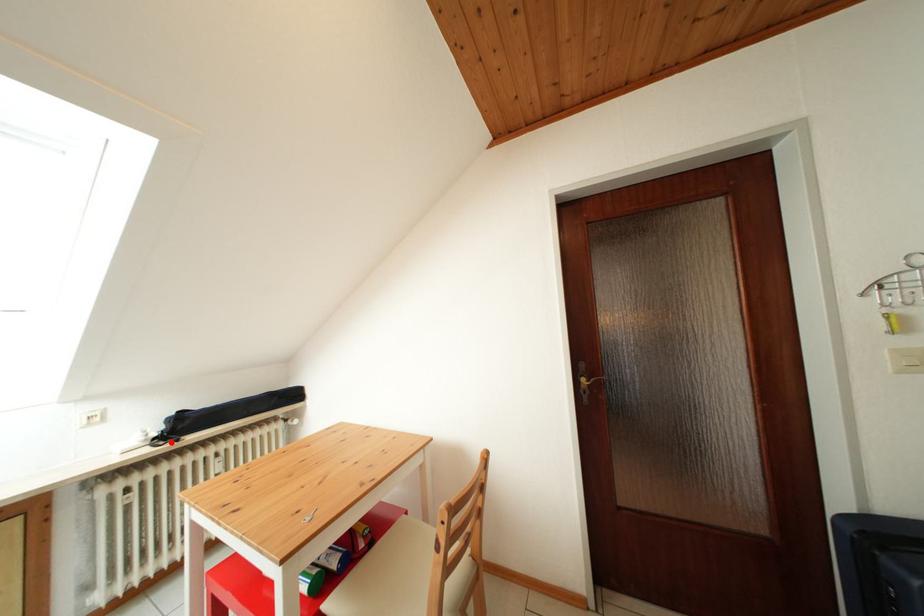
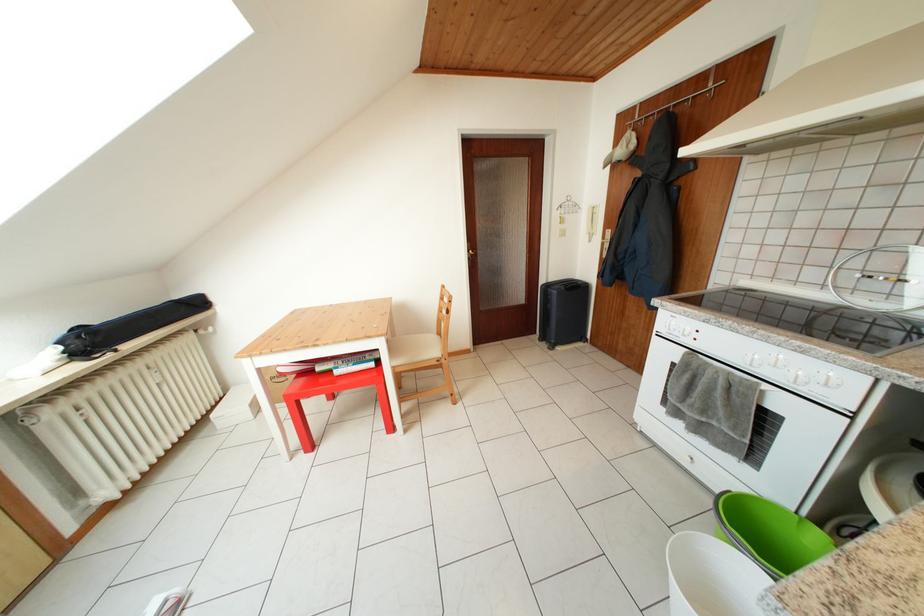
In the second image, find the point that corresponds to the highlighted location in the first image.

(89, 359)